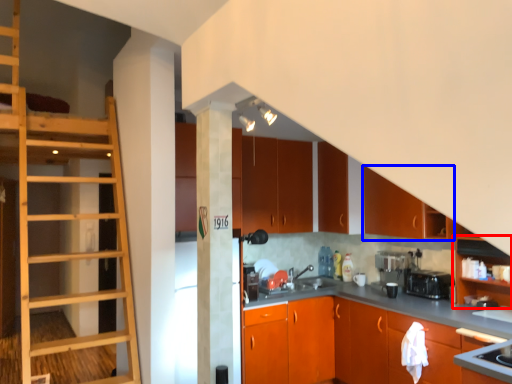
Question: Which point is further to the camera, cabinetry (highlighted by a red box) or cabinetry (highlighted by a blue box)?

Choices:
 (A) cabinetry
 (B) cabinetry

Answer: (B)